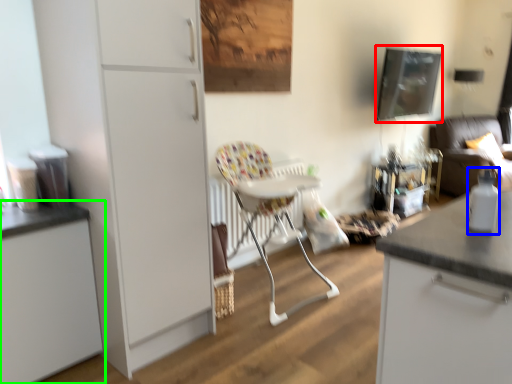
Question: Which object is positioned closest to picture frame (highlighted by a red box)? Select from bottle (highlighted by a blue box) and cabinetry (highlighted by a green box).

Choices:
 (A) bottle
 (B) cabinetry

Answer: (A)